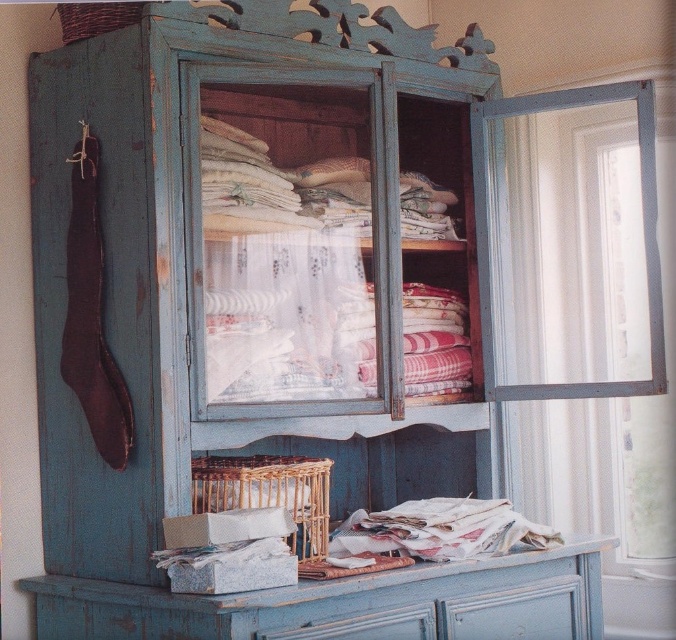
You are standing in front of the vintage cabinet and want to place a small figurine on the surface closest to you. Which point should you choose between point [554,600] and point [72,22]?

Point [554,600] is further to the viewer than point [72,22], so you should place the figurine on point [554,600] as it is closer to you.

You are organizing items in the vintage cabinet and need to place a small ornament. The ornament must be placed to the left of the distressed blue drawer at lower center. Where should you place it in relation to the woven brown basket at upper left?

The ornament should be placed to the left of the distressed blue drawer at lower center, which is to the right of the woven brown basket at upper left. Therefore, placing the ornament to the left of the distressed blue drawer at lower center would mean it is positioned between the woven brown basket at upper left and the drawer.

You are organizing items in a vintage cabinet and need to place a small decorative item. Where exactly is the distressed blue drawer at lower center located in the cabinet?

The distressed blue drawer at lower center is located at point coordinates of (516, 612).